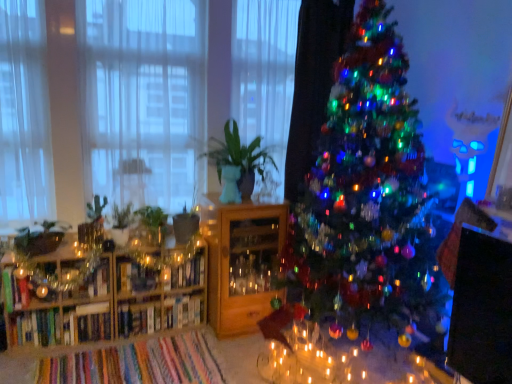
This screenshot has width=512, height=384. What are the coordinates of `empty space that is ontop of metallic glass shelf at left, acting as the 2th shelf starting from the right (from a real-world perspective)` in the screenshot? It's located at (78, 258).